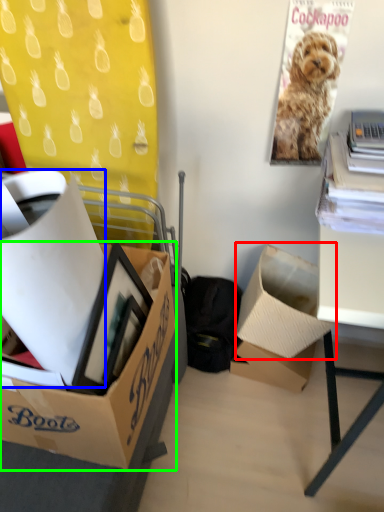
Question: Estimate the real-world distances between objects in this image. Which object is farther from box (highlighted by a red box), box (highlighted by a blue box) or box (highlighted by a green box)?

Choices:
 (A) box
 (B) box

Answer: (A)